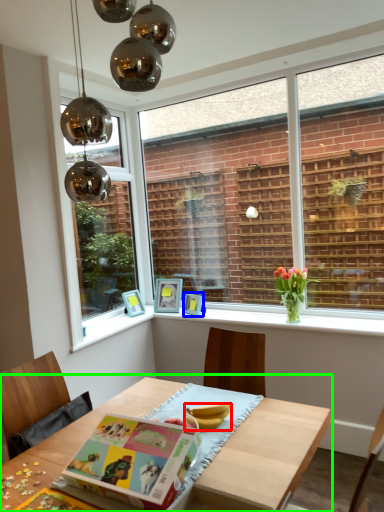
Question: Which object is the farthest from banana (highlighted by a red box)? Choose among these: picture frame (highlighted by a blue box) or table (highlighted by a green box).

Choices:
 (A) picture frame
 (B) table

Answer: (A)